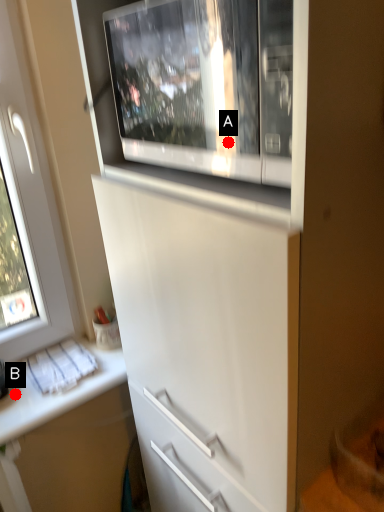
Question: Two points are circled on the image, labeled by A and B beside each circle. Which point is closer to the camera?

Choices:
 (A) A is closer
 (B) B is closer

Answer: (A)